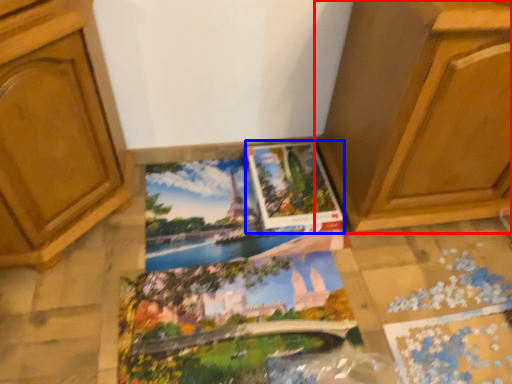
Question: Among these objects, which one is farthest to the camera, cabinetry (highlighted by a red box) or album (highlighted by a blue box)?

Choices:
 (A) cabinetry
 (B) album

Answer: (B)